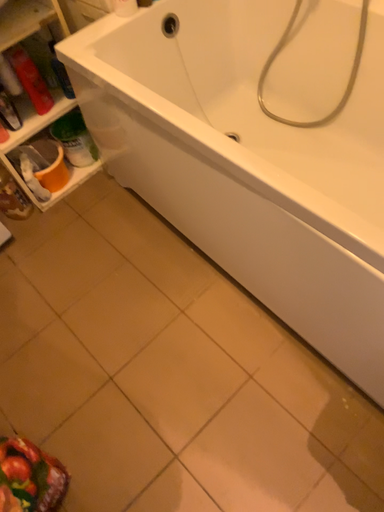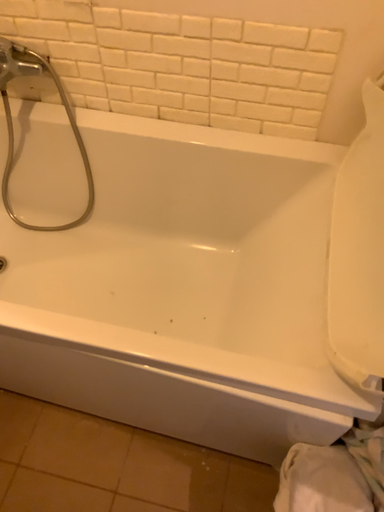
Question: How did the camera likely rotate when shooting the video?

Choices:
 (A) rotated downward
 (B) rotated upward

Answer: (B)